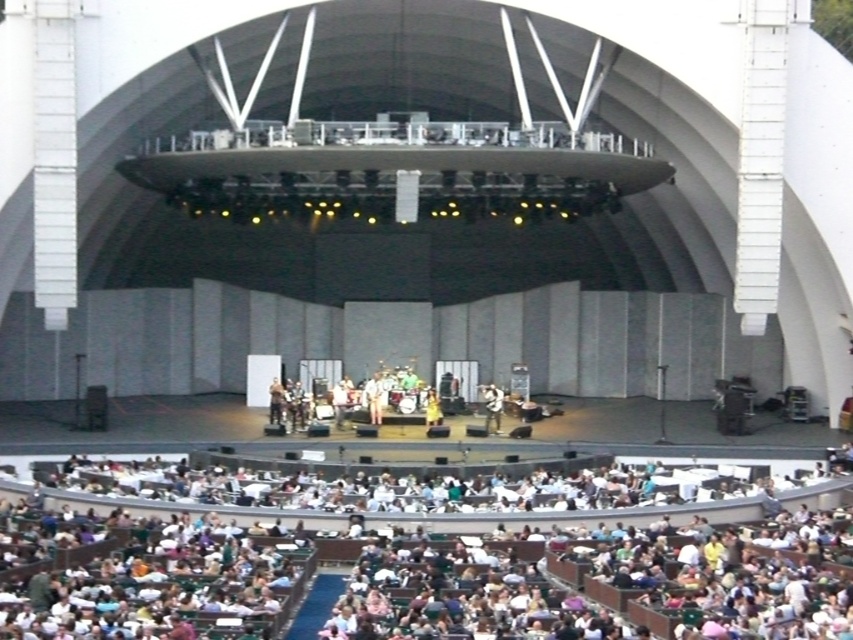
Question: Is white fabric dress at center to the right of white fabric shirt at center from the viewer's perspective?

Choices:
 (A) no
 (B) yes

Answer: (A)

Question: Which point is closer to the camera?

Choices:
 (A) (276, 419)
 (B) (495, 419)

Answer: (A)

Question: Estimate the real-world distances between objects in this image. Which object is closer to the white fabric shirt at center?

Choices:
 (A) white fabric dress at center stage
 (B) matte black guitar at center

Answer: (A)

Question: Can you confirm if white fabric dress at center is thinner than white fabric shirt at center?

Choices:
 (A) yes
 (B) no

Answer: (B)

Question: Can you confirm if white fabric dress at center is thinner than white fabric dress at center stage?

Choices:
 (A) no
 (B) yes

Answer: (A)

Question: Among these points, which one is farthest from the camera?

Choices:
 (A) (492, 394)
 (B) (279, 417)
 (C) (339, 410)

Answer: (A)